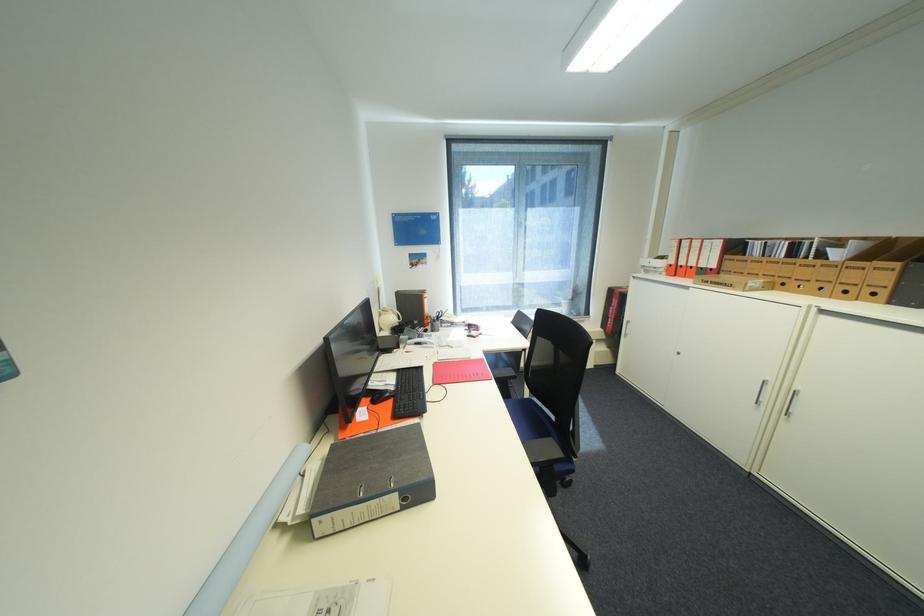
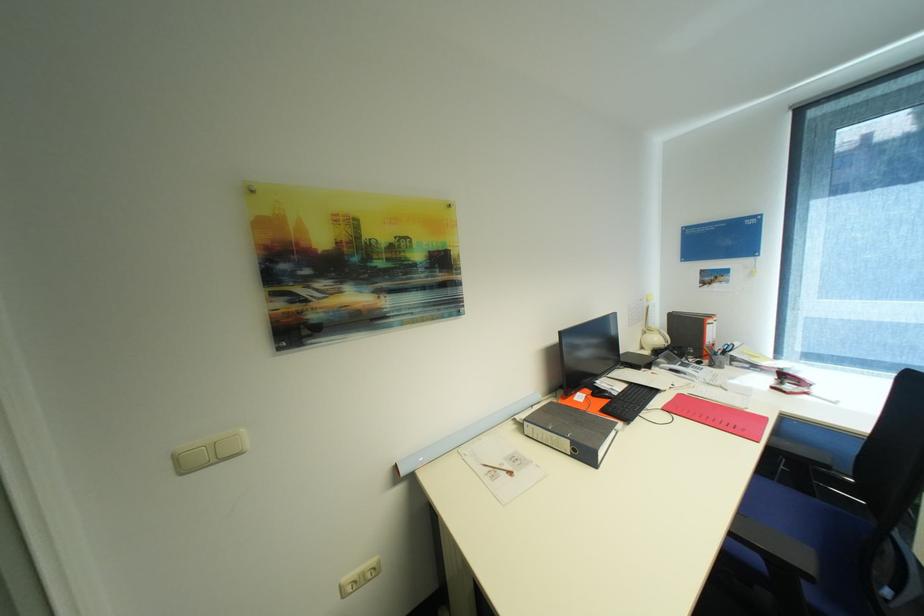
Where in the second image is the point corresponding to point (442, 384) from the first image?

(671, 410)